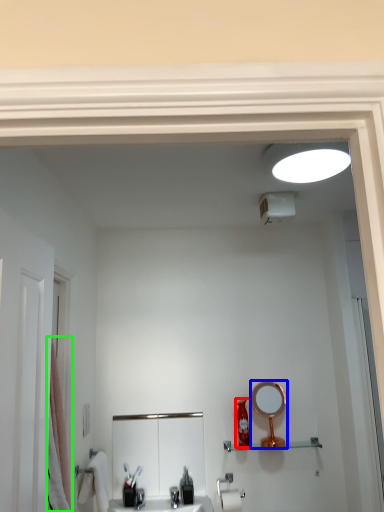
Question: Which object is positioned farthest from toiletry (highlighted by a red box)? Select from mirror (highlighted by a blue box) and shower curtain (highlighted by a green box).

Choices:
 (A) mirror
 (B) shower curtain

Answer: (B)